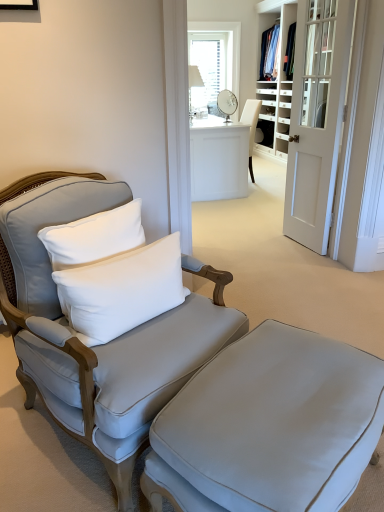
Question: Does matte gray ottoman at lower center have a larger size compared to white glass window at upper center?

Choices:
 (A) yes
 (B) no

Answer: (B)

Question: Is white glass window at upper center at the back of matte gray ottoman at lower center?

Choices:
 (A) yes
 (B) no

Answer: (B)

Question: Can you confirm if matte gray ottoman at lower center is taller than white glass window at upper center?

Choices:
 (A) no
 (B) yes

Answer: (A)

Question: Does matte gray ottoman at lower center come in front of white glass window at upper center?

Choices:
 (A) yes
 (B) no

Answer: (A)

Question: Does matte gray ottoman at lower center appear on the right side of white glass window at upper center?

Choices:
 (A) no
 (B) yes

Answer: (A)

Question: Can you confirm if matte gray ottoman at lower center is positioned to the left of white glass window at upper center?

Choices:
 (A) yes
 (B) no

Answer: (A)

Question: Can you see matte gray ottoman at lower center touching white glossy desk at center?

Choices:
 (A) no
 (B) yes

Answer: (A)

Question: Is matte gray ottoman at lower center wider than white glossy desk at center?

Choices:
 (A) no
 (B) yes

Answer: (A)

Question: Can you confirm if matte gray ottoman at lower center is thinner than white glossy desk at center?

Choices:
 (A) yes
 (B) no

Answer: (A)

Question: Considering the relative sizes of matte gray ottoman at lower center and white glossy desk at center in the image provided, is matte gray ottoman at lower center smaller than white glossy desk at center?

Choices:
 (A) yes
 (B) no

Answer: (A)

Question: Is matte gray ottoman at lower center not within white glossy desk at center?

Choices:
 (A) no
 (B) yes

Answer: (B)

Question: Does matte gray ottoman at lower center have a larger size compared to white glossy desk at center?

Choices:
 (A) yes
 (B) no

Answer: (B)

Question: Is the depth of satin gray armchair at left greater than that of white glass window at upper center?

Choices:
 (A) no
 (B) yes

Answer: (A)